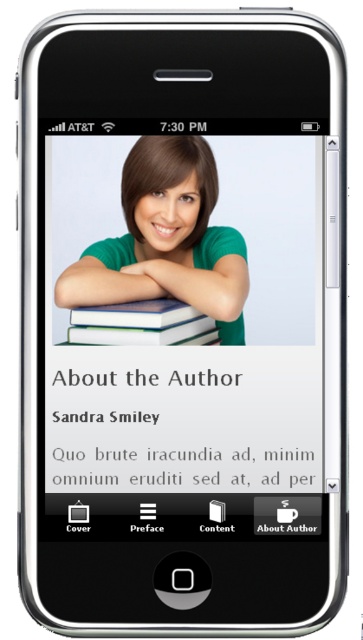
Can you confirm if black paper text at center is positioned to the left of green matte shirt at center?

In fact, black paper text at center is to the right of green matte shirt at center.

Measure the distance between black paper text at center and green matte shirt at center.

The distance of black paper text at center from green matte shirt at center is 7.51 inches.

Measure the distance between point (214, 410) and camera.

Point (214, 410) and camera are 3.69 feet apart from each other.

You are a GUI agent. You are given a task and a screenshot of the screen. Output one action in this format:
    pyautogui.click(x=<x>, y=<y>)
    Task: Click on the black paper text at center
    
    Given the screenshot: What is the action you would take?
    pyautogui.click(x=184, y=422)